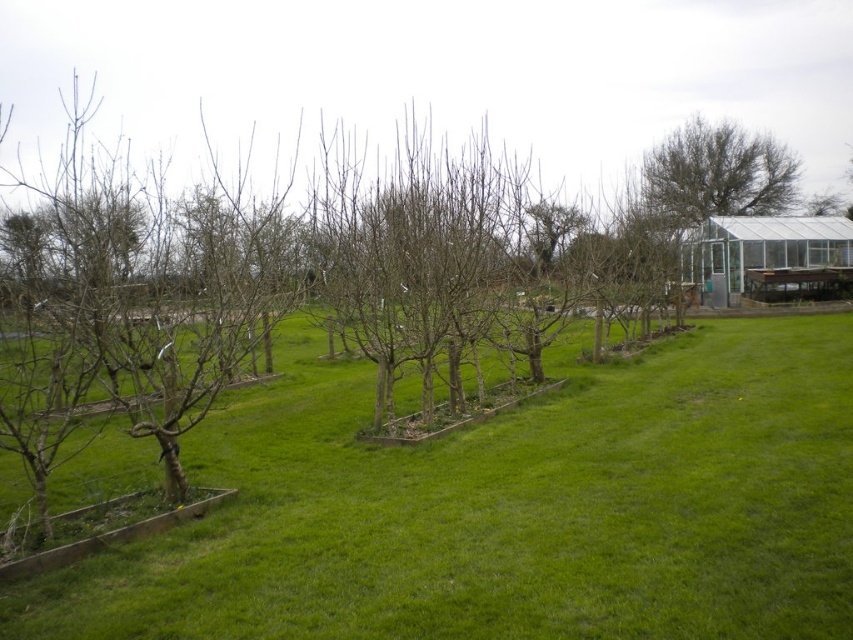
You are a gardener planning to water the green grassy at center and the green leafy tree at upper right. Based on their positions, which direction should you move from the tree to reach the grassy area?

The green grassy at center is to the left of green leafy tree at upper right, so you should move to the left from the tree to reach the grassy area.

You are a gardener who wants to plant a new flower bed between the green grassy at center and the green leafy tree at upper right. Considering their heights, which object should you place the flower bed closer to?

You should place the flower bed closer to the green grassy at center because it has a lesser height compared to the green leafy tree at upper right, so the flower bed will be less obstructed by the taller tree.

You are standing at the entrance of the greenhouse and want to walk to the green grassy at center. Which direction should you go?

You should go to the left to reach the green grassy at center because the greenhouse is on the right side of the image, so the grassy area is located to the left of the greenhouse.